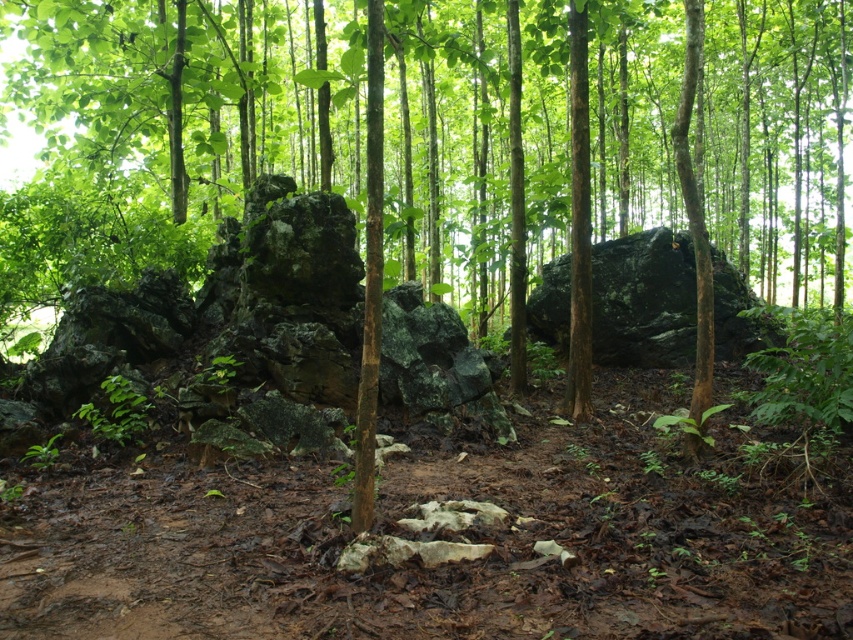
You are a hiker trying to determine the tallest object between the green rough bark tree at center and the dark gray rough rock at center in the forest. Which one is taller?

The green rough bark tree at center is taller than the dark gray rough rock at center.

You are a hiker who wants to place a 10 meter long tent between the green rough bark tree at center and the dark gray rough rock at center. Can you fit the tent between them without moving any objects?

The distance between the green rough bark tree at center and the dark gray rough rock at center is 12.37 meters, so the 10 meter long tent can fit between them since the space is larger than the tent.

You are standing in the forest and want to take a photo of both the green rough bark tree at center and the dark gray rough rock at center. Since you want both to be in the frame, which object should you position closer to the camera to include both in your shot?

The green rough bark tree at center is positioned on the right side of dark gray rough rock at center. To include both in the frame, you should position the dark gray rough rock at center closer to the camera since it is behind the tree.